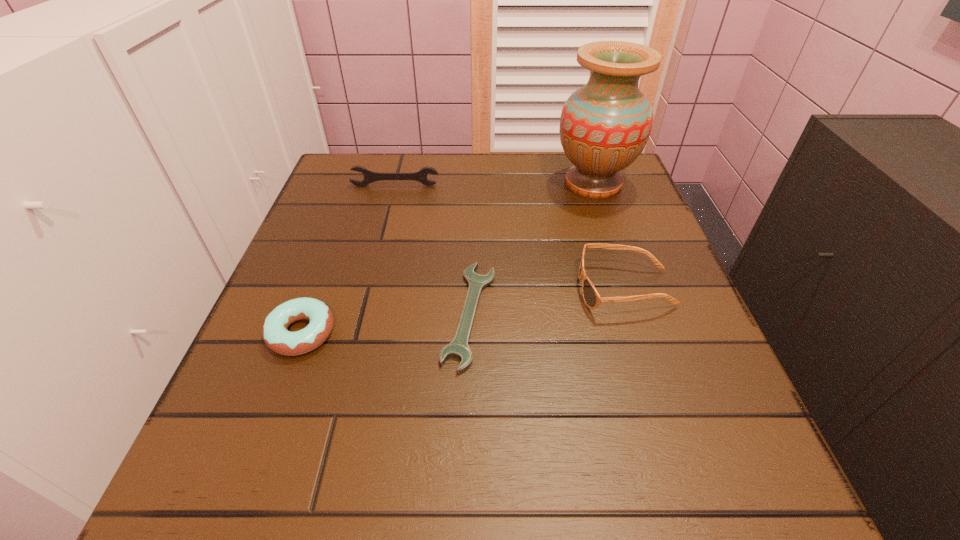
Where is `free space that satisfies the following two spatial constraints: 1. on the open ends of the left wrench; 2. on the left side of the third object from right to left`? This screenshot has height=540, width=960. free space that satisfies the following two spatial constraints: 1. on the open ends of the left wrench; 2. on the left side of the third object from right to left is located at coordinates (363, 314).

In order to click on free space that satisfies the following two spatial constraints: 1. on the open ends of the farther wrench; 2. on the right side of the shorter wrench in this screenshot , I will do `click(363, 314)`.

This screenshot has height=540, width=960. I want to click on vacant space that satisfies the following two spatial constraints: 1. on the front side of the vase; 2. on the front-facing side of the sunglasses, so click(629, 289).